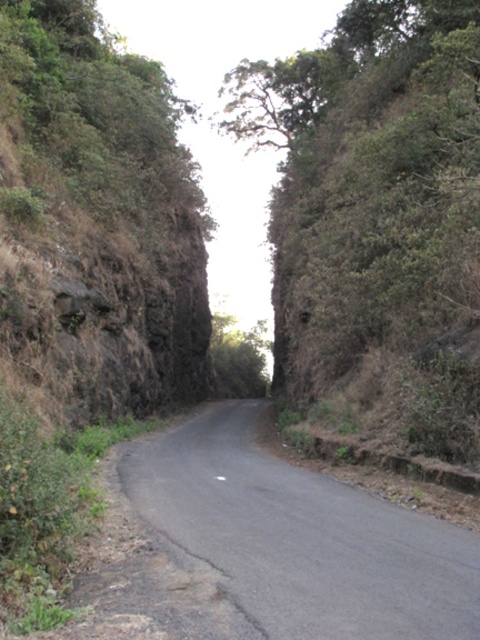
Can you confirm if green leafy tree at center is positioned to the left of black asphalt road at center?

In fact, green leafy tree at center is to the right of black asphalt road at center.

Does green leafy tree at center lie behind black asphalt road at center?

Yes, it is behind black asphalt road at center.

Is point (319, 403) farther from viewer compared to point (478, 593)?

Yes, point (319, 403) is farther from viewer.

What are the coordinates of `green leafy tree at center` in the screenshot? It's located at (375, 220).